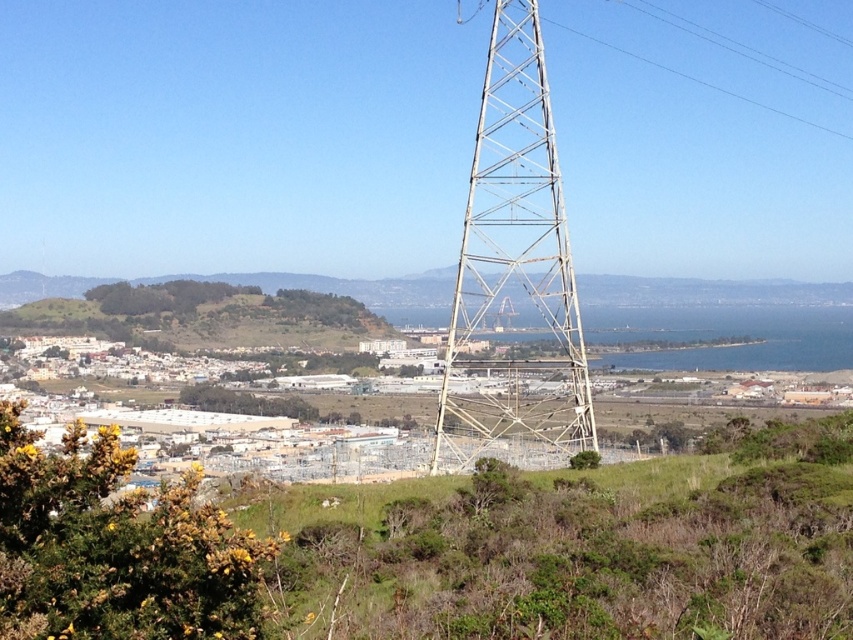
Question: Does metallic structure at center appear under green grassy hillside at center?

Choices:
 (A) yes
 (B) no

Answer: (B)

Question: Which point appears farthest from the camera in this image?

Choices:
 (A) (106, 301)
 (B) (468, 264)

Answer: (A)

Question: Is metallic structure at center to the right of green grassy hillside at center from the viewer's perspective?

Choices:
 (A) yes
 (B) no

Answer: (A)

Question: Which of the following is the closest to the observer?

Choices:
 (A) (556, 221)
 (B) (177, 282)

Answer: (A)

Question: Observing the image, what is the correct spatial positioning of metallic structure at center in reference to green grassy hillside at center?

Choices:
 (A) right
 (B) left

Answer: (A)